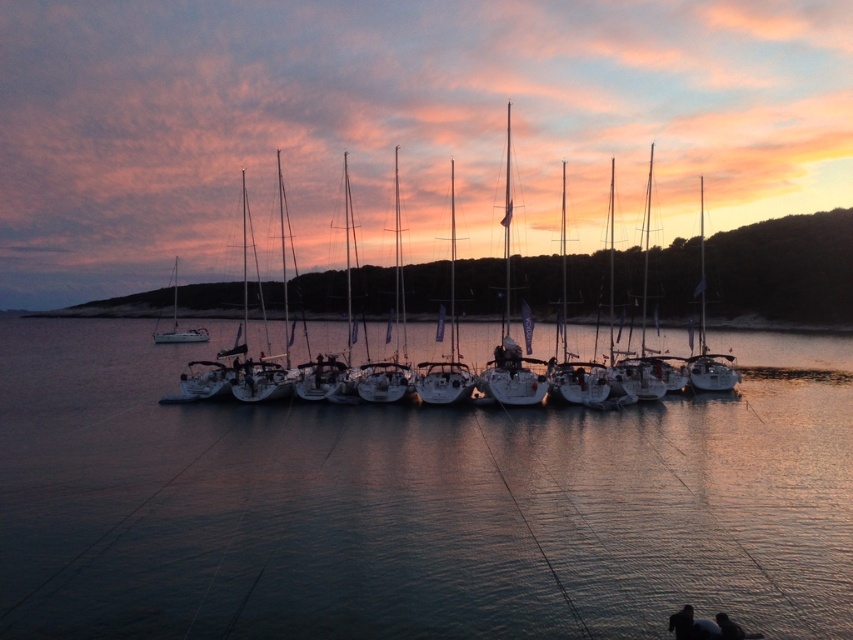
Is white matte sailboat at center below white matte sailboat at left?

Incorrect, white matte sailboat at center is not positioned below white matte sailboat at left.

Does white matte sailboat at center appear over white matte sailboat at left?

Correct, white matte sailboat at center is located above white matte sailboat at left.

Which is in front, point (442, 394) or point (199, 336)?

Point (442, 394) is more forward.

The width and height of the screenshot is (853, 640). I want to click on white matte sailboat at center, so click(270, 355).

Is point (241, 456) positioned before point (399, 346)?

Yes, point (241, 456) is closer to viewer.

Who is positioned more to the right, clear water at center or white matte sailboat at center?

From the viewer's perspective, white matte sailboat at center appears more on the right side.

At what (x,y) coordinates should I click in order to perform the action: click on clear water at center. Please return your answer as a coordinate pair (x, y). This screenshot has height=640, width=853. Looking at the image, I should click on (413, 506).

This screenshot has height=640, width=853. What do you see at coordinates (413, 506) in the screenshot?
I see `clear water at center` at bounding box center [413, 506].

Based on the photo, is clear water at center wider than white matte sailboat at left?

Yes.

Does point (729, 586) lie behind point (177, 275)?

No, (729, 586) is closer to viewer.

In order to click on clear water at center in this screenshot , I will do `click(413, 506)`.